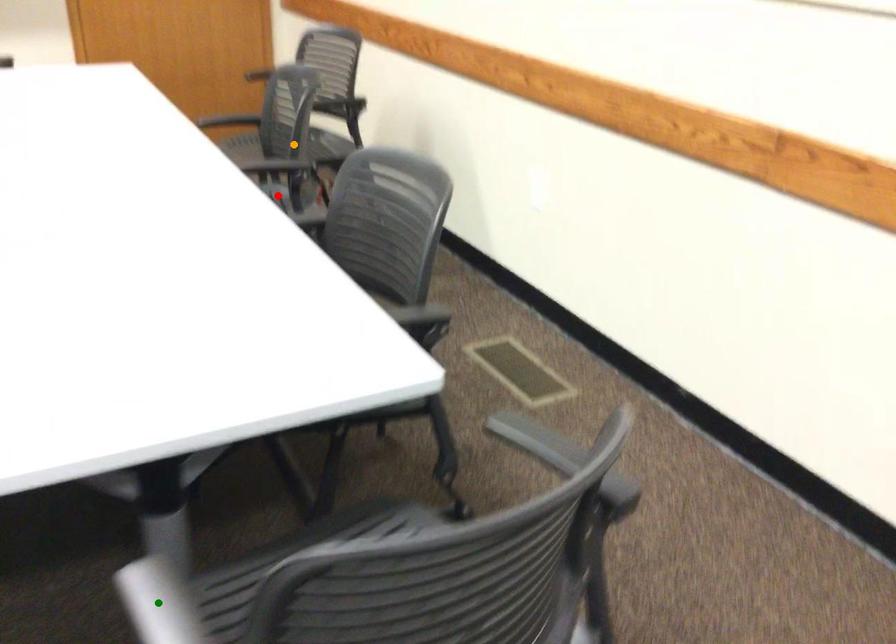
Order these from nearest to farthest:
A) green point
B) red point
C) orange point

green point, red point, orange point